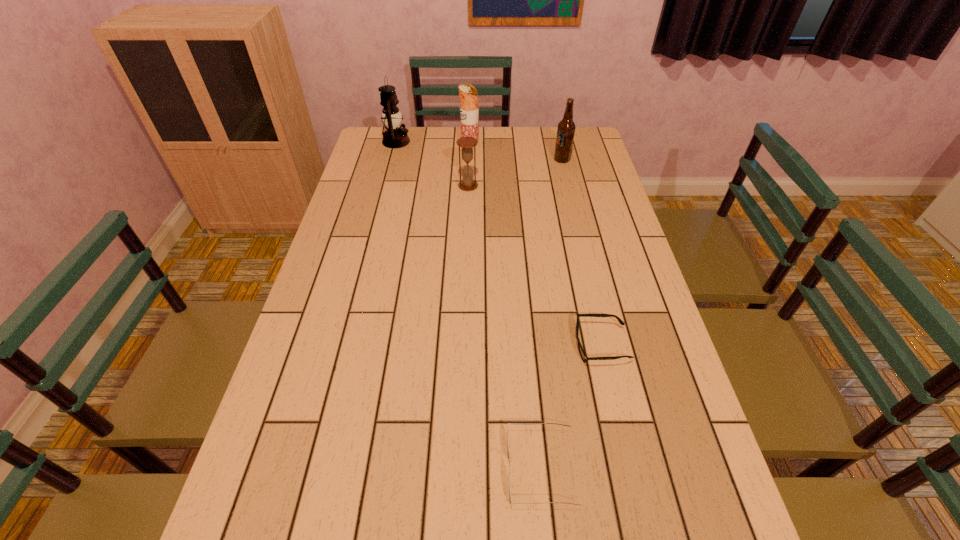
Where is `unoccupied position between the leftmost object and the hourglass`? This screenshot has height=540, width=960. unoccupied position between the leftmost object and the hourglass is located at coordinates (432, 164).

The height and width of the screenshot is (540, 960). Identify the location of free area in between the third object from right to left and the hourglass. (505, 327).

This screenshot has width=960, height=540. What are the coordinates of `object that is the fifth nearest to the farther sunglasses` in the screenshot? It's located at (394, 137).

Locate an element on the screen. This screenshot has width=960, height=540. object that can be found as the third closest to the leftmost object is located at coordinates (566, 128).

Find the location of `free space in the image that satisfies the following two spatial constraints: 1. on the side of the burrito, there is a wick adjustment knob; 2. on the left side of the leftmost object`. free space in the image that satisfies the following two spatial constraints: 1. on the side of the burrito, there is a wick adjustment knob; 2. on the left side of the leftmost object is located at coordinates (396, 145).

Where is `vacant space that satisfies the following two spatial constraints: 1. on the back side of the third nearest object; 2. on the left side of the burrito`? vacant space that satisfies the following two spatial constraints: 1. on the back side of the third nearest object; 2. on the left side of the burrito is located at coordinates (469, 145).